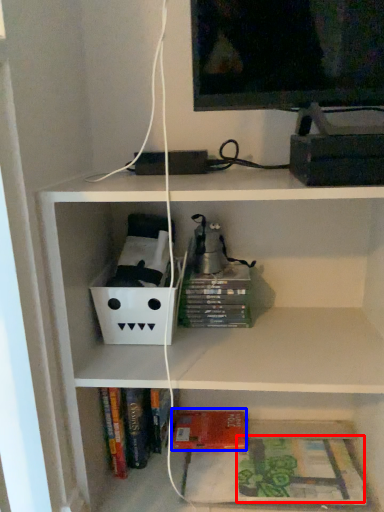
Question: Which object appears farthest to the camera in this image, book (highlighted by a red box) or paperback book (highlighted by a blue box)?

Choices:
 (A) book
 (B) paperback book

Answer: (B)